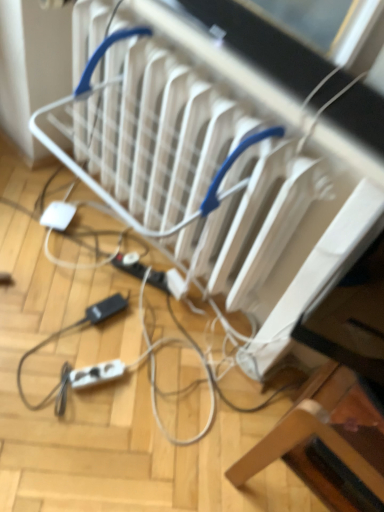
Question: In the image, is white plastic radiator at center on the left side or the right side of white plastic extension cord at lower center, which is counted as the second extension cord, starting from the bottom?

Choices:
 (A) left
 (B) right

Answer: (B)

Question: Considering the positions of point (158, 82) and point (140, 279), is point (158, 82) closer or farther from the camera than point (140, 279)?

Choices:
 (A) closer
 (B) farther

Answer: (A)

Question: Based on their relative distances, which object is farther from the white plastic radiator at center?

Choices:
 (A) white plastic extension cord at lower center, which is counted as the second extension cord, starting from the bottom
 (B) wooden chair at lower right
 (C) white plastic extension cord at lower left, placed as the 1th extension cord when sorted from front to back

Answer: (C)

Question: Which object is positioned closest to the white plastic extension cord at lower center, which is counted as the second extension cord, starting from the bottom?

Choices:
 (A) white plastic extension cord at lower left, which ranks as the 1th extension cord in bottom-to-top order
 (B) white plastic radiator at center
 (C) wooden chair at lower right

Answer: (A)